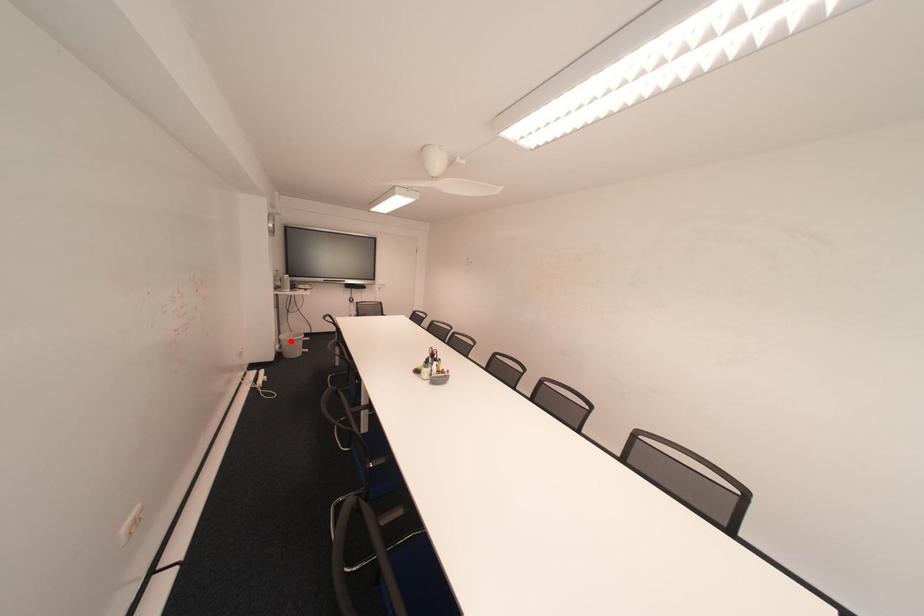
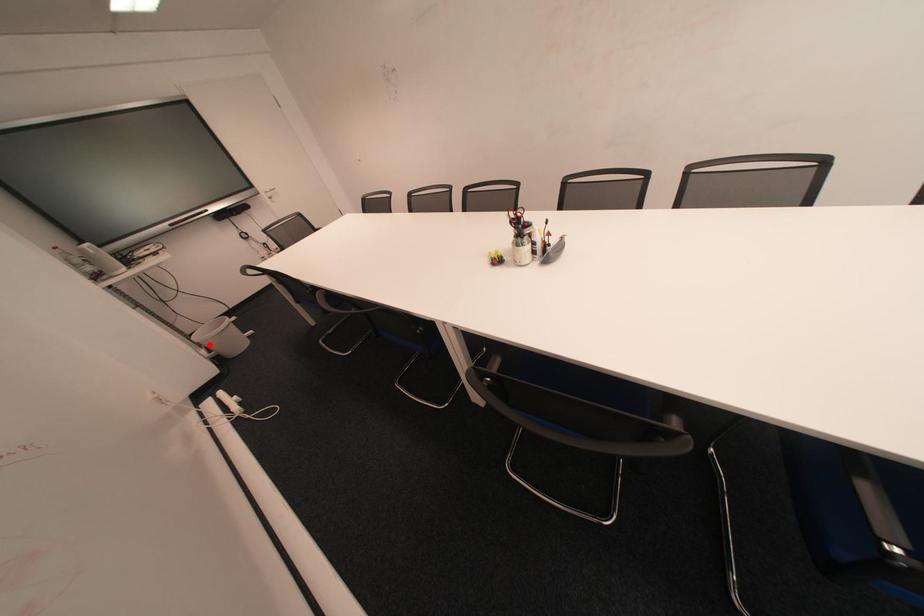
I am providing you with two images of the same scene from different viewpoints. A red point is marked on the first image and another point is marked on the second image. Is the red point in image1 aligned with the point shown in image2?

Yes